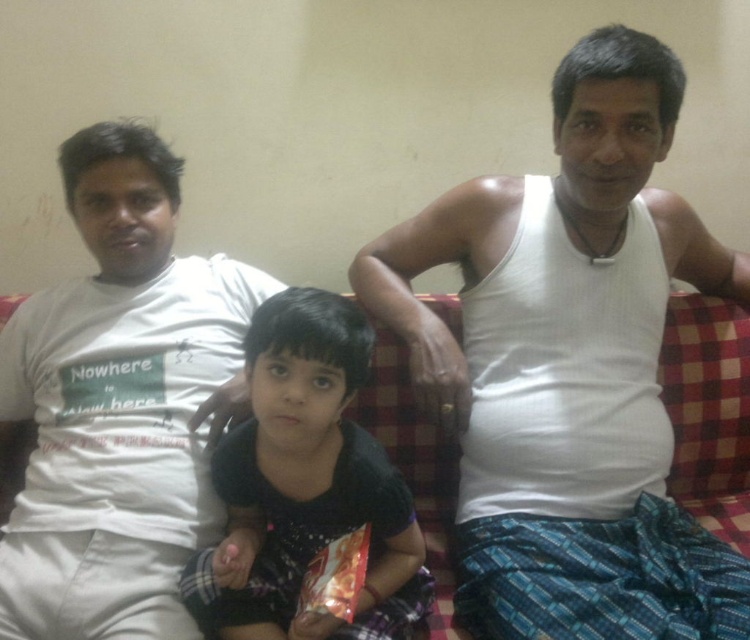
Question: Is white cotton t-shirt at left below dark blue fabric dress at center?

Choices:
 (A) no
 (B) yes

Answer: (A)

Question: Is white cotton t-shirt at left thinner than dark blue fabric dress at center?

Choices:
 (A) yes
 (B) no

Answer: (B)

Question: Which point is closer to the camera taking this photo?

Choices:
 (A) (165, 268)
 (B) (372, 616)

Answer: (B)

Question: Is the position of white cotton t-shirt at left less distant than that of dark blue fabric dress at center?

Choices:
 (A) yes
 (B) no

Answer: (B)

Question: Which point is farther to the camera?

Choices:
 (A) (75, 547)
 (B) (207, 554)

Answer: (B)